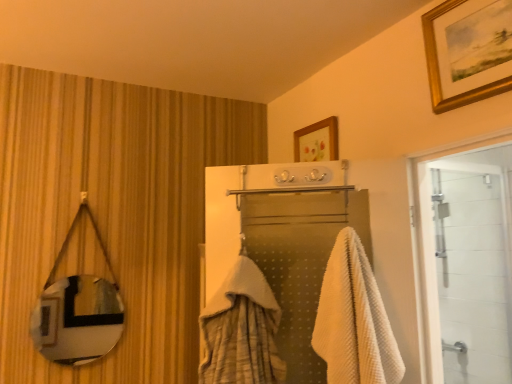
Question: Is white glass door at right to the right of gold-framed picture at upper right from the viewer's perspective?

Choices:
 (A) yes
 (B) no

Answer: (A)

Question: Is white glass door at right positioned with its back to gold-framed picture at upper right?

Choices:
 (A) yes
 (B) no

Answer: (B)

Question: Are white glass door at right and gold-framed picture at upper right making contact?

Choices:
 (A) yes
 (B) no

Answer: (B)

Question: Considering the relative sizes of white glass door at right and gold-framed picture at upper right in the image provided, is white glass door at right bigger than gold-framed picture at upper right?

Choices:
 (A) no
 (B) yes

Answer: (B)

Question: Is the depth of white glass door at right less than that of gold-framed picture at upper right?

Choices:
 (A) yes
 (B) no

Answer: (B)

Question: Is white glass door at right at the left side of gold-framed picture at upper right?

Choices:
 (A) yes
 (B) no

Answer: (B)

Question: Can you confirm if white glass door at right is smaller than white waffle towel at center?

Choices:
 (A) no
 (B) yes

Answer: (A)

Question: Is white glass door at right positioned with its back to white waffle towel at center?

Choices:
 (A) yes
 (B) no

Answer: (B)

Question: Considering the relative positions of white glass door at right and white waffle towel at center in the image provided, is white glass door at right to the right of white waffle towel at center from the viewer's perspective?

Choices:
 (A) yes
 (B) no

Answer: (A)

Question: Is white glass door at right aimed at white waffle towel at center?

Choices:
 (A) no
 (B) yes

Answer: (A)

Question: From a real-world perspective, is white glass door at right under white waffle towel at center?

Choices:
 (A) yes
 (B) no

Answer: (B)

Question: From the image's perspective, is white glass door at right below white waffle towel at center?

Choices:
 (A) no
 (B) yes

Answer: (B)

Question: Can you confirm if gold-framed picture at upper right is thinner than white waffle towel at center?

Choices:
 (A) yes
 (B) no

Answer: (A)